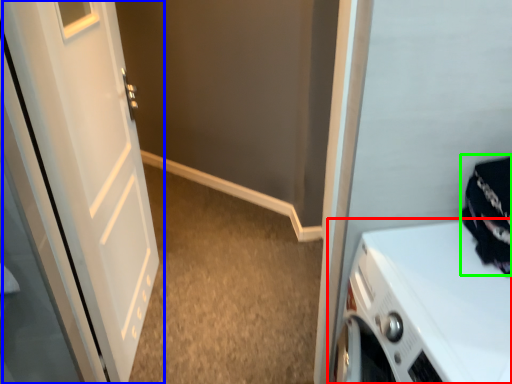
Question: Which object is positioned closest to home appliance (highlighted by a red box)? Select from door (highlighted by a blue box) and clothing (highlighted by a green box).

Choices:
 (A) door
 (B) clothing

Answer: (B)